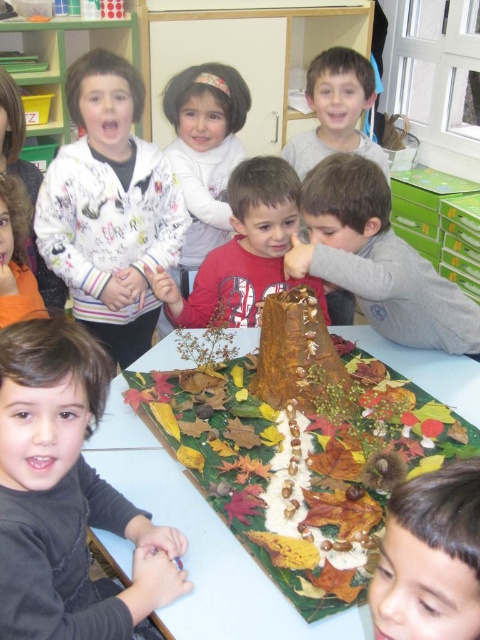
You are a teacher organizing a craft activity and need to place both the brown textured paper at center and the brown textured tree trunk at center on a shelf. Which object requires more horizontal space on the shelf?

The brown textured tree trunk at center requires more horizontal space because it has a greater width than the brown textured paper at center.

You are a tailor measuring garments for a school event. You have a white printed sweater at upper left and a smooth brown tree trunk at center. Which item is narrower?

The white printed sweater at upper left is narrower than the smooth brown tree trunk at center.